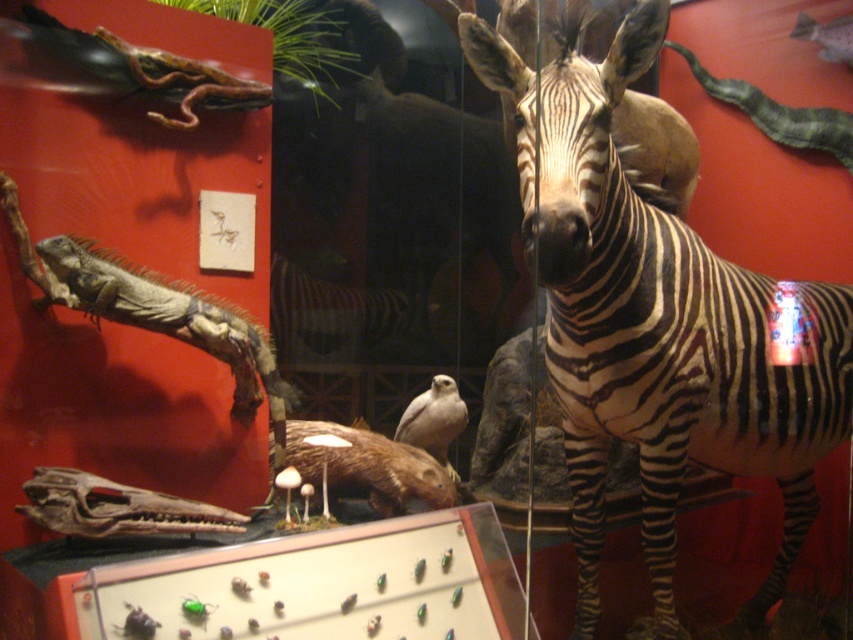
Question: Which point appears farthest from the camera in this image?

Choices:
 (A) (186, 292)
 (B) (778, 467)

Answer: (B)

Question: Which of the following is the farthest from the observer?

Choices:
 (A) white feathered bird at center
 (B) black and white striped zebra at center
 (C) green scaly lizard at left

Answer: (A)

Question: From the image, what is the correct spatial relationship of black and white striped zebra at center in relation to white feathered bird at center?

Choices:
 (A) above
 (B) below

Answer: (A)

Question: Does green scaly lizard at left have a greater width compared to white feathered bird at center?

Choices:
 (A) no
 (B) yes

Answer: (B)

Question: Can you confirm if black and white striped zebra at center is positioned to the left of green scaly lizard at left?

Choices:
 (A) yes
 (B) no

Answer: (B)

Question: Which is farther from the white feathered bird at center?

Choices:
 (A) green scaly lizard at left
 (B) black and white striped zebra at center

Answer: (B)